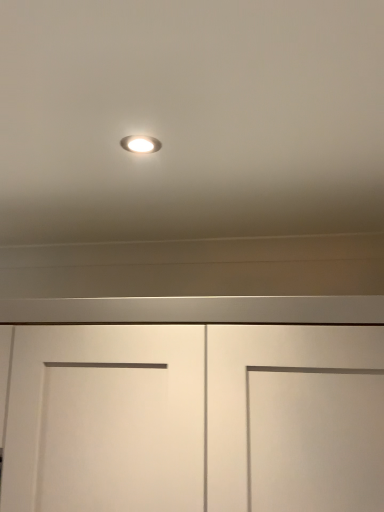
In order to face white matte door at center, should I rotate leftwards or rightwards?

Turn left by 5.797 degrees to look at white matte door at center.

Describe the element at coordinates (195, 418) in the screenshot. I see `white matte door at center` at that location.

Where is `white matte door at center`? white matte door at center is located at coordinates (195, 418).

I want to click on white matte door at center, so click(x=195, y=418).